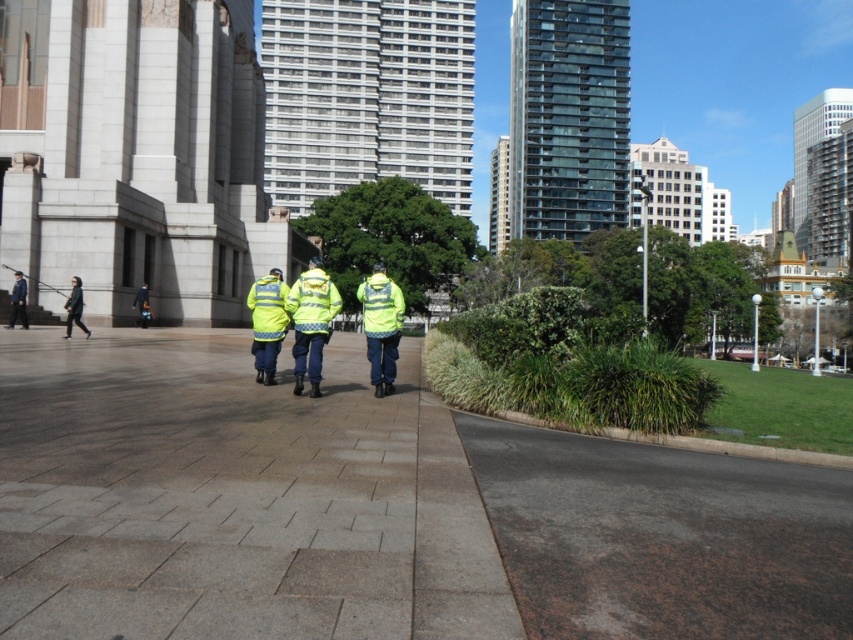
Question: Is high-visibility reflective jacket at center bigger than yellow reflective jacket at left?

Choices:
 (A) yes
 (B) no

Answer: (A)

Question: Is black asphalt road at lower right positioned behind high-visibility yellow safety vest at center?

Choices:
 (A) yes
 (B) no

Answer: (B)

Question: Observing the image, what is the correct spatial positioning of yellow reflective safety vest at center in reference to yellow reflective jacket at left?

Choices:
 (A) right
 (B) left

Answer: (A)

Question: Among these objects, which one is farthest from the camera?

Choices:
 (A) yellow reflective safety vest at center
 (B) black asphalt road at lower right
 (C) high-visibility yellow safety vest at center
 (D) reflective yellow jacket at left

Answer: (D)

Question: Which of the following is the farthest from the observer?

Choices:
 (A) yellow reflective safety vest at center
 (B) high-visibility fabric safety vest at center

Answer: (A)

Question: Which point is farther to the camera?

Choices:
 (A) (24, 307)
 (B) (300, 316)
 (C) (146, 296)
 (D) (384, 337)

Answer: (C)